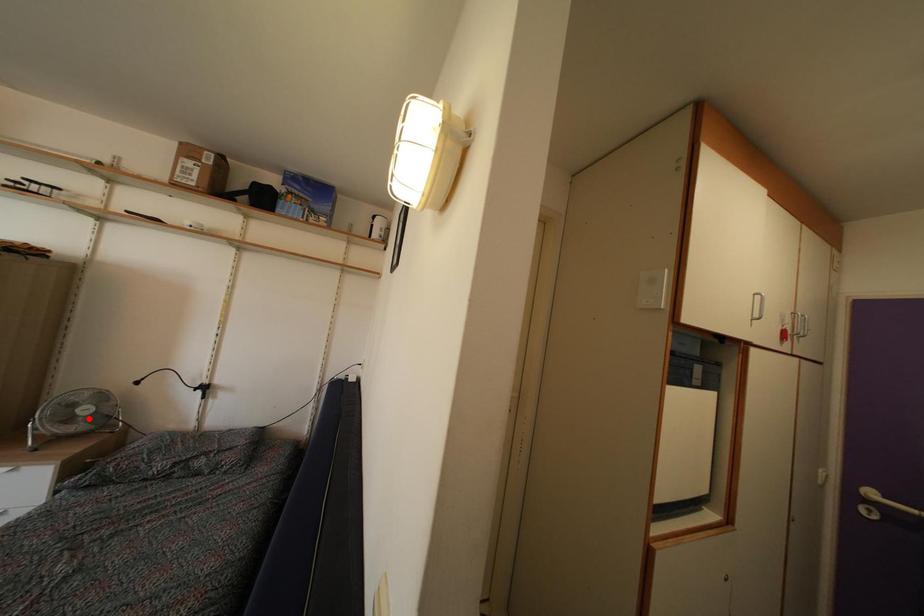
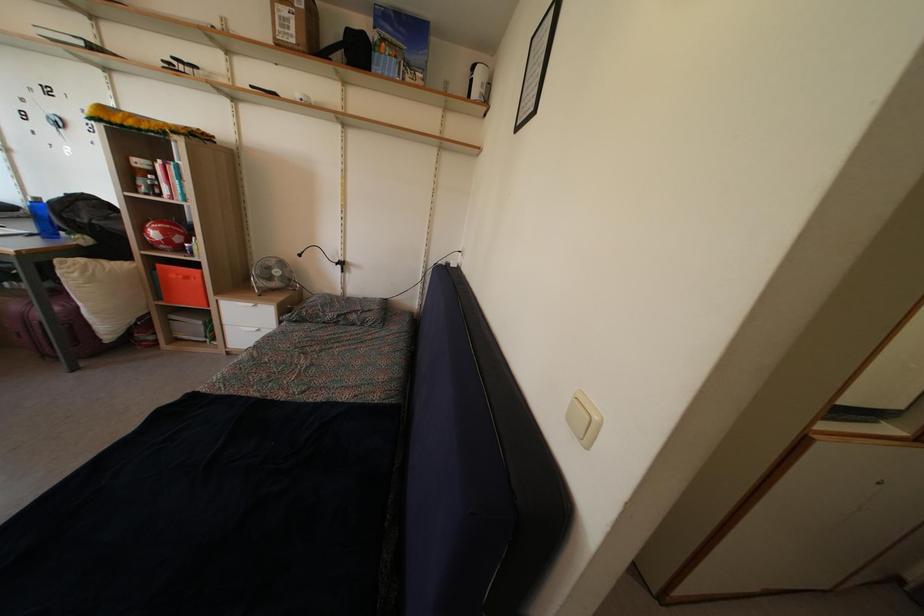
Question: A red point is marked in image1. In image2, is the corresponding 3D point closer to the camera or farther? Reply with the corresponding letter.

Choices:
 (A) The corresponding 3D point is closer.
 (B) The corresponding 3D point is farther.

Answer: (A)